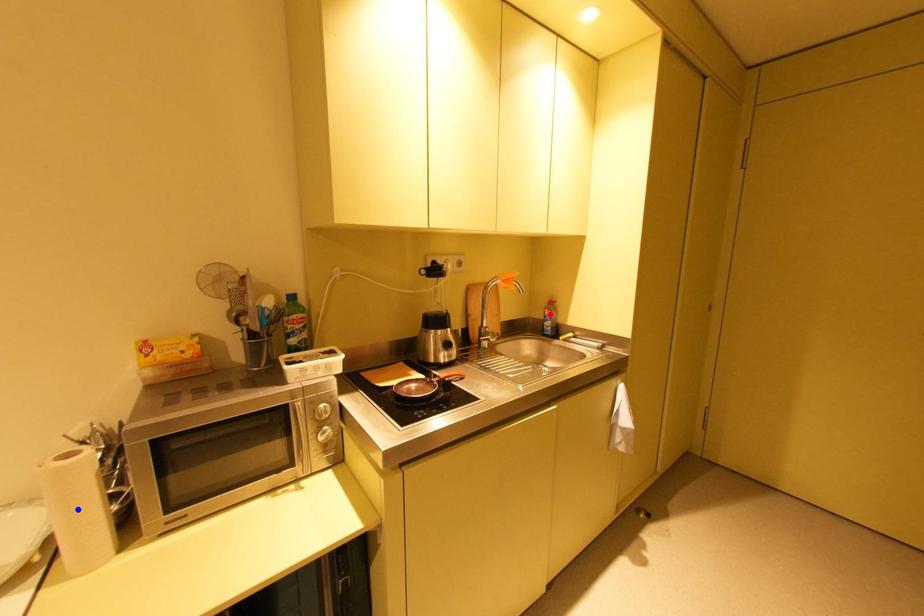
Question: Which of the two points in the image is closer to the camera?

Choices:
 (A) Blue point is closer.
 (B) Red point is closer.

Answer: (A)